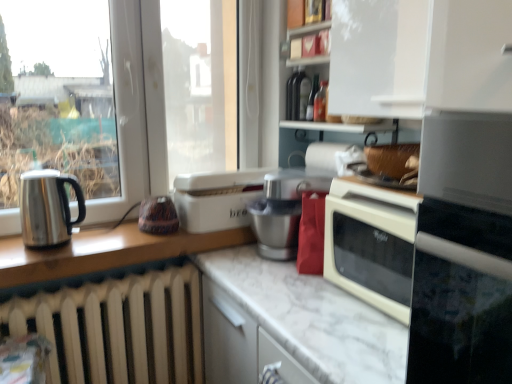
Question: From the image's perspective, is white matte cabinet at upper right located above or below stainless steel kettle at left, the first kitchen appliance from the front?

Choices:
 (A) above
 (B) below

Answer: (A)

Question: In terms of size, does white matte cabinet at upper right appear bigger or smaller than stainless steel kettle at left, the first kitchen appliance from the front?

Choices:
 (A) small
 (B) big

Answer: (B)

Question: Considering the real-world distances, which object is closest to the white glossy shelf at upper center?

Choices:
 (A) metallic silver food processor at center
 (B) stainless steel kettle at left, marked as the 1th kitchen appliance in a left-to-right arrangement
 (C) white marble countertop at center
 (D) white plastic bread bin at center, which is the 1th kitchen appliance from back to front
 (E) white matte cabinet at upper right

Answer: (E)

Question: Which of these objects is positioned farthest from the white plastic bread bin at center, acting as the 2th kitchen appliance starting from the front?

Choices:
 (A) white glossy shelf at upper center
 (B) white matte cabinet at upper right
 (C) white marble countertop at center
 (D) stainless steel kettle at left, the first kitchen appliance from the front
 (E) metallic silver food processor at center

Answer: (B)